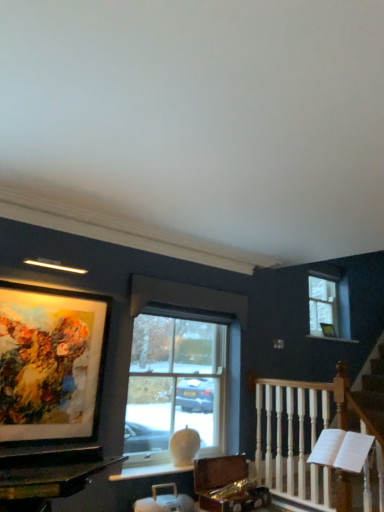
Question: Considering the positions of white marble window sill at upper center and matte glass picture frame at upper left in the image, is white marble window sill at upper center taller or shorter than matte glass picture frame at upper left?

Choices:
 (A) tall
 (B) short

Answer: (B)

Question: Choose the correct answer: Is white marble window sill at upper center inside matte glass picture frame at upper left or outside it?

Choices:
 (A) inside
 (B) outside

Answer: (B)

Question: Which object is positioned farthest from the white marble window sill at upper center?

Choices:
 (A) clear glass window at center, acting as the 1th window starting from the front
 (B) clear glass window at upper right, the 2th window positioned from the left
 (C) white wooden railing at right
 (D) matte glass picture frame at upper left

Answer: (D)

Question: Based on their relative distances, which object is nearer to the clear glass window at center, which is the 2th window from right to left?

Choices:
 (A) clear glass window at upper right, which is the first window from back to front
 (B) matte glass picture frame at upper left
 (C) white wooden railing at right
 (D) white marble window sill at upper center

Answer: (C)